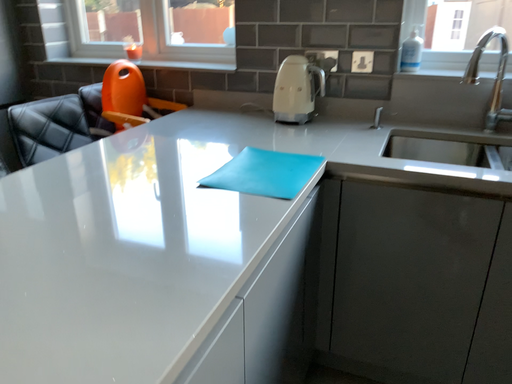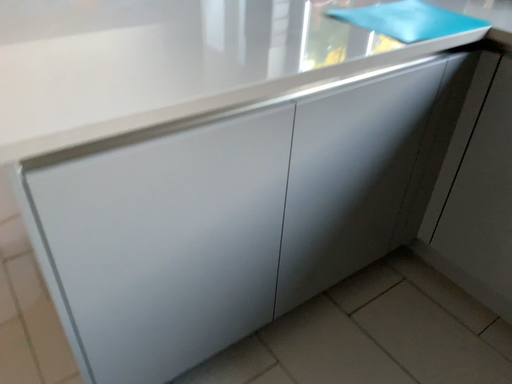
Question: Which way did the camera rotate in the video?

Choices:
 (A) rotated downward
 (B) rotated upward

Answer: (A)